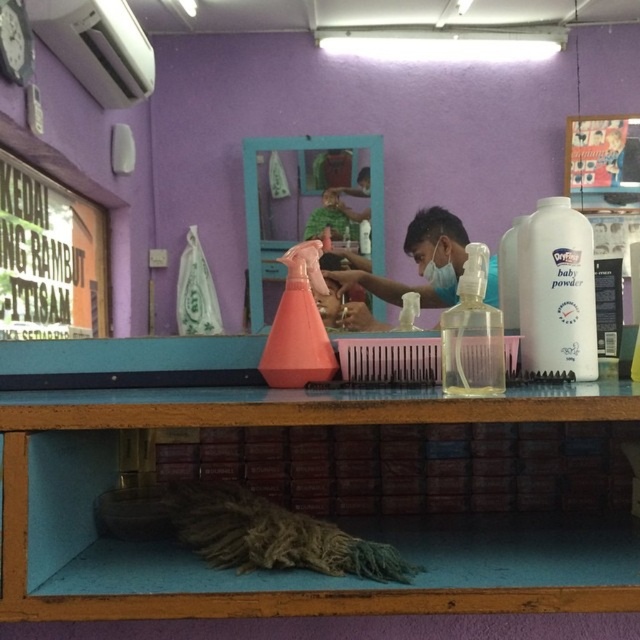
You are a customer in the barbershop and need to place your phone on the counter between the white plastic baby powder at right and the clear plastic spray bottle at center. Can you fit it there?

The white plastic baby powder at right is smaller than the clear plastic spray bottle at center, so there should be enough space between them to place your phone.

You are standing in a barbershop and need to reach an object located at point (236, 602). If your arm can extend 28 inches, can you comfortably reach it?

The distance between you and the point (236, 602) is 29.32 inches. Since your arm can only extend 28 inches, you cannot comfortably reach it.

You are a customer in the barbershop and want to reach the white plastic baby powder at right and the transparent plastic bottle at center to sanitize your hands. Which item is closer to you if you are standing directly in front of the counter?

The transparent plastic bottle at center is closer to you because the white plastic baby powder at right is positioned under it, meaning the bottle is above and thus nearer when standing in front of the counter.